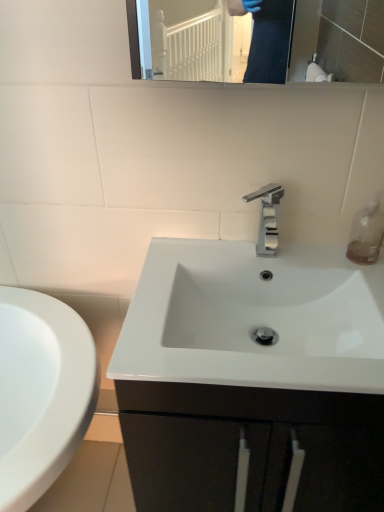
Where is `polished chrome faucet at center`? polished chrome faucet at center is located at coordinates (267, 217).

What do you see at coordinates (267, 217) in the screenshot? I see `polished chrome faucet at center` at bounding box center [267, 217].

Where is `transparent plastic soap dispenser at upper right`? Image resolution: width=384 pixels, height=512 pixels. transparent plastic soap dispenser at upper right is located at coordinates (366, 234).

Describe the element at coordinates (366, 234) in the screenshot. I see `transparent plastic soap dispenser at upper right` at that location.

Find the location of a particular element. polished chrome faucet at center is located at coordinates (267, 217).

Which object is positioned more to the left, transparent plastic soap dispenser at upper right or polished chrome faucet at center?

From the viewer's perspective, polished chrome faucet at center appears more on the left side.

Is transparent plastic soap dispenser at upper right closer to the viewer compared to polished chrome faucet at center?

No, transparent plastic soap dispenser at upper right is further to the viewer.

Between point (377, 217) and point (266, 253), which one is positioned behind?

The point (266, 253) is behind.

From the image's perspective, does transparent plastic soap dispenser at upper right appear lower than polished chrome faucet at center?

Yes, from the image's perspective, transparent plastic soap dispenser at upper right is beneath polished chrome faucet at center.

From a real-world perspective, is transparent plastic soap dispenser at upper right located beneath polished chrome faucet at center?

Yes, from a real-world perspective, transparent plastic soap dispenser at upper right is under polished chrome faucet at center.

Is transparent plastic soap dispenser at upper right wider than polished chrome faucet at center?

Incorrect, the width of transparent plastic soap dispenser at upper right does not surpass that of polished chrome faucet at center.

Who is taller, transparent plastic soap dispenser at upper right or polished chrome faucet at center?

polished chrome faucet at center.

Which of these two, transparent plastic soap dispenser at upper right or polished chrome faucet at center, is bigger?

Bigger between the two is polished chrome faucet at center.

Is polished chrome faucet at center located within transparent plastic soap dispenser at upper right?

No, polished chrome faucet at center is not surrounded by transparent plastic soap dispenser at upper right.

Is transparent plastic soap dispenser at upper right far from polished chrome faucet at center?

No, there isn't a large distance between transparent plastic soap dispenser at upper right and polished chrome faucet at center.

Looking at this image, is transparent plastic soap dispenser at upper right looking in the opposite direction of polished chrome faucet at center?

No, transparent plastic soap dispenser at upper right is not facing away from polished chrome faucet at center.

What's the angular difference between transparent plastic soap dispenser at upper right and polished chrome faucet at center's facing directions?

The facing directions of transparent plastic soap dispenser at upper right and polished chrome faucet at center are 0.000413 degrees apart.

You are a GUI agent. You are given a task and a screenshot of the screen. Output one action in this format:
    pyautogui.click(x=<x>, y=<y>)
    Task: Click on the tap above the transparent plastic soap dispenser at upper right (from a real-world perspective)
    
    Given the screenshot: What is the action you would take?
    pyautogui.click(x=267, y=217)

Which object is positioned more to the right, polished chrome faucet at center or transparent plastic soap dispenser at upper right?

transparent plastic soap dispenser at upper right.

Who is more distant, polished chrome faucet at center or transparent plastic soap dispenser at upper right?

transparent plastic soap dispenser at upper right.

Does point (274, 212) appear closer or farther from the camera than point (362, 216)?

Point (274, 212) is farther from the camera than point (362, 216).

From the image's perspective, is polished chrome faucet at center above or below transparent plastic soap dispenser at upper right?

Clearly, from the image's perspective, polished chrome faucet at center is above transparent plastic soap dispenser at upper right.

From a real-world perspective, is polished chrome faucet at center above or below transparent plastic soap dispenser at upper right?

From a real-world perspective, polished chrome faucet at center is physically above transparent plastic soap dispenser at upper right.

Which of these two, polished chrome faucet at center or transparent plastic soap dispenser at upper right, is thinner?

transparent plastic soap dispenser at upper right is thinner.

Is polished chrome faucet at center taller or shorter than transparent plastic soap dispenser at upper right?

Considering their sizes, polished chrome faucet at center has more height than transparent plastic soap dispenser at upper right.

Can you confirm if polished chrome faucet at center is bigger than transparent plastic soap dispenser at upper right?

Yes.

Is polished chrome faucet at center not inside transparent plastic soap dispenser at upper right?

Yes, polished chrome faucet at center is outside of transparent plastic soap dispenser at upper right.

Are polished chrome faucet at center and transparent plastic soap dispenser at upper right beside each other?

No, polished chrome faucet at center is not next to transparent plastic soap dispenser at upper right.

Is polished chrome faucet at center looking in the opposite direction of transparent plastic soap dispenser at upper right?

That's not correct — polished chrome faucet at center is not looking away from transparent plastic soap dispenser at upper right.

The height and width of the screenshot is (512, 384). Identify the location of tap lying above the transparent plastic soap dispenser at upper right (from the image's perspective). (267, 217).

This screenshot has height=512, width=384. Find the location of `soap dispenser below the polished chrome faucet at center (from the image's perspective)`. soap dispenser below the polished chrome faucet at center (from the image's perspective) is located at coordinates (366, 234).

Where is `tap above the transparent plastic soap dispenser at upper right (from a real-world perspective)`? The image size is (384, 512). tap above the transparent plastic soap dispenser at upper right (from a real-world perspective) is located at coordinates (267, 217).